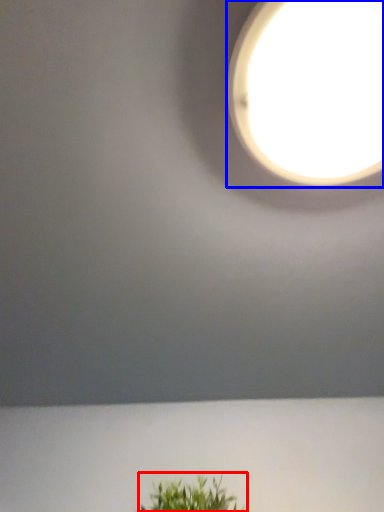
Question: Which of the following is the closest to the observer, houseplant (highlighted by a red box) or lamp (highlighted by a blue box)?

Choices:
 (A) houseplant
 (B) lamp

Answer: (B)